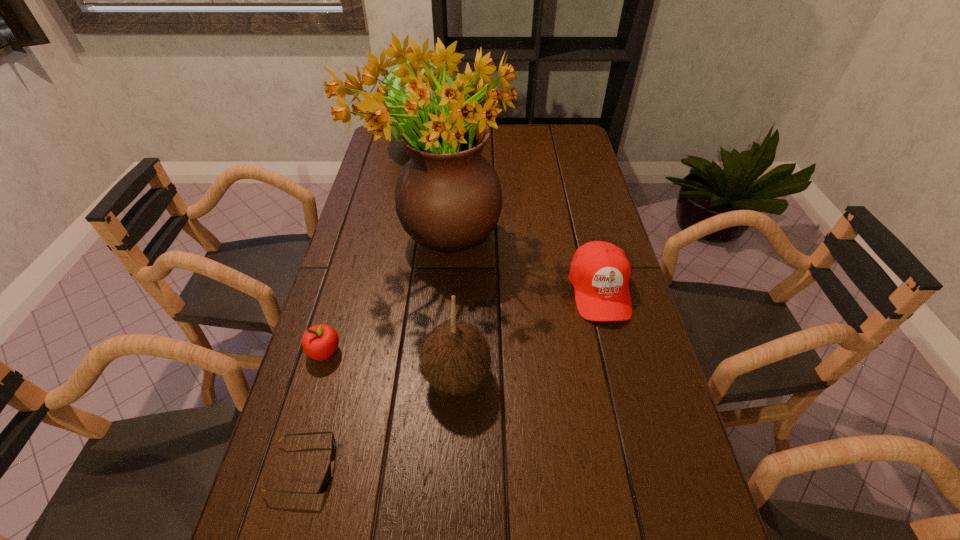
Locate an element on the screen. free space located 0.140m on the right of the watermelon is located at coordinates (504, 145).

The image size is (960, 540). Find the location of `vacant space situated 0.150m on the surface of the fourth shortest object`. vacant space situated 0.150m on the surface of the fourth shortest object is located at coordinates (560, 377).

Where is `free spot located on the front panel of the baseball cap`? The height and width of the screenshot is (540, 960). free spot located on the front panel of the baseball cap is located at coordinates (612, 343).

Find the location of a particular element. The image size is (960, 540). free spot located 0.290m on the front of the apple is located at coordinates (281, 502).

You are a GUI agent. You are given a task and a screenshot of the screen. Output one action in this format:
    pyautogui.click(x=<x>, y=<y>)
    Task: Click on the free space located 0.070m on the lenses of the nearest object
    
    Given the screenshot: What is the action you would take?
    pyautogui.click(x=370, y=468)

The width and height of the screenshot is (960, 540). What are the coordinates of `object that is positioned at the far edge` in the screenshot? It's located at (395, 81).

Where is `flower arrangement that is at the left edge`? This screenshot has height=540, width=960. flower arrangement that is at the left edge is located at coordinates (448, 197).

What are the coordinates of `watermelon that is at the left edge` in the screenshot? It's located at (395, 81).

Where is `apple that is at the left edge`? This screenshot has height=540, width=960. apple that is at the left edge is located at coordinates (320, 342).

The width and height of the screenshot is (960, 540). Find the location of `sunglasses present at the left edge`. sunglasses present at the left edge is located at coordinates (325, 482).